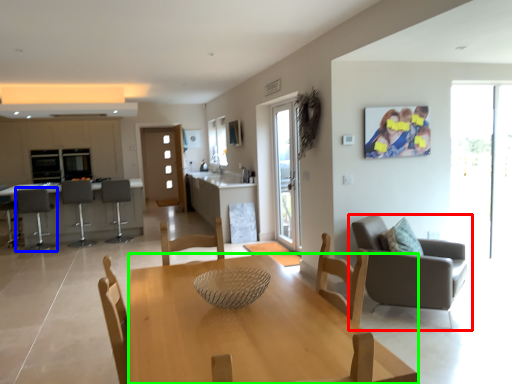
Question: Which object is positioned closest to chair (highlighted by a red box)? Select from chair (highlighted by a blue box) and desk (highlighted by a green box).

Choices:
 (A) chair
 (B) desk

Answer: (B)